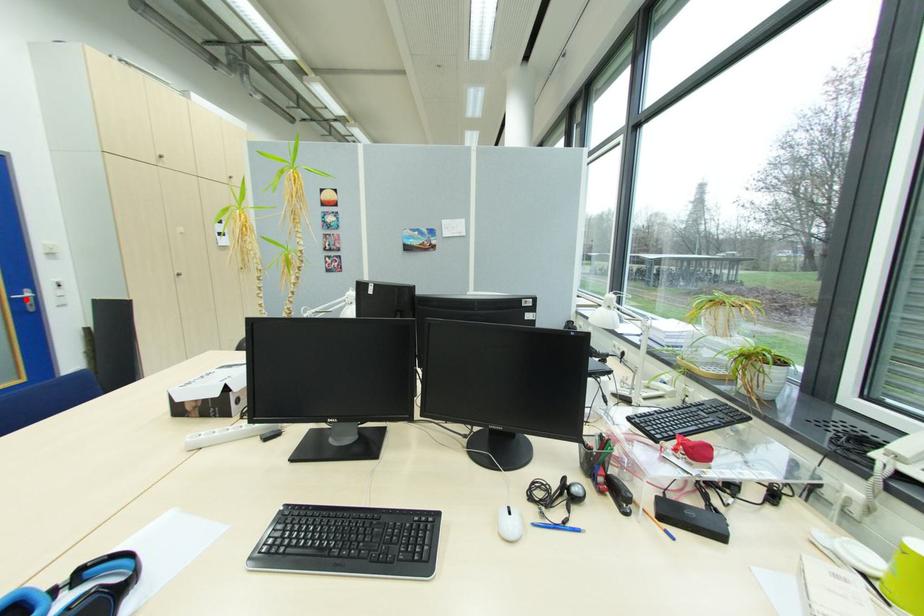
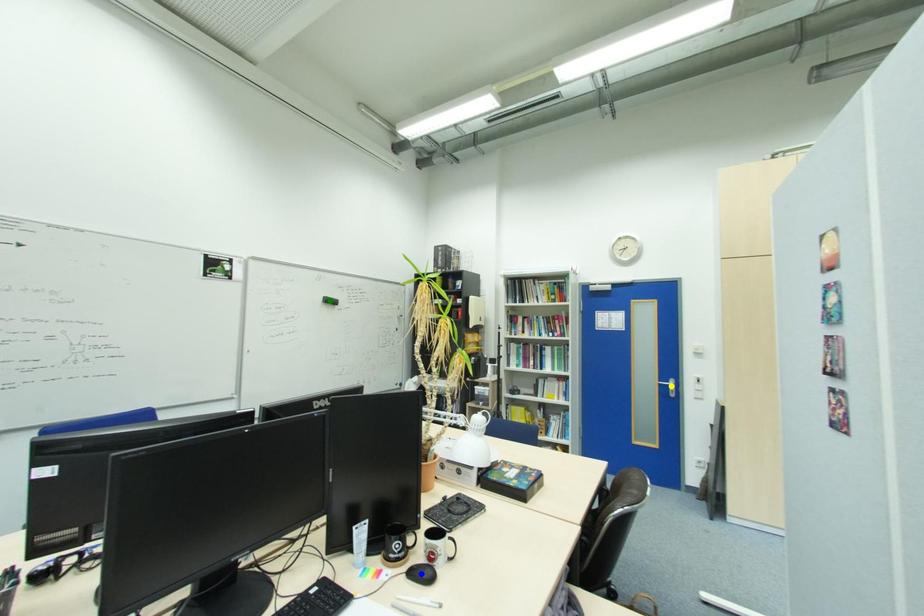
Question: I am providing you with two images of the same scene from different viewpoints. A red point is marked on the first image. You are given multiple points on the second image. Which spot in image 2 lines up with the point in image 1?

Choices:
 (A) yellow point
 (B) green point
 (C) blue point

Answer: (A)